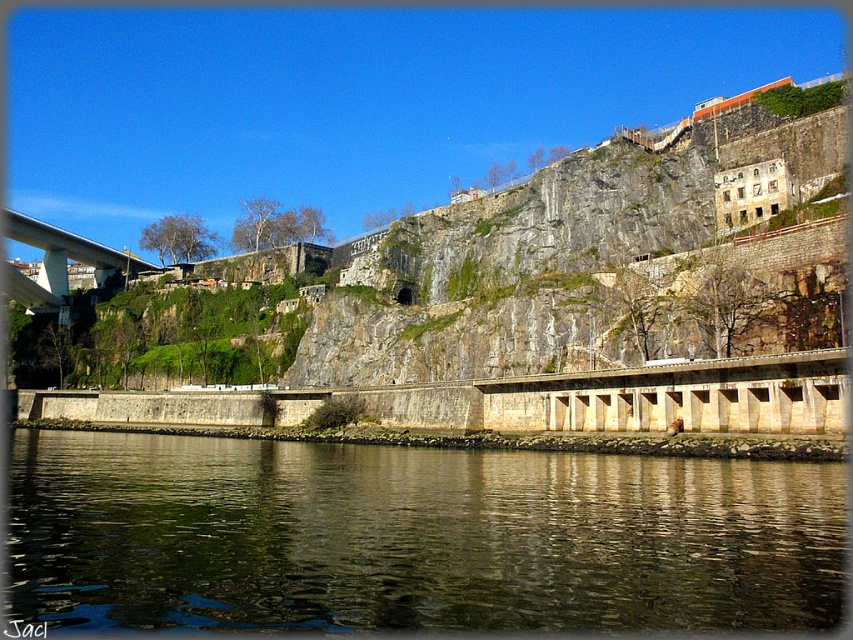
Question: Is dark reflective water at lower center bigger than concrete bridge at left?

Choices:
 (A) yes
 (B) no

Answer: (B)

Question: Is dark reflective water at lower center below concrete bridge at left?

Choices:
 (A) no
 (B) yes

Answer: (B)

Question: Among these objects, which one is nearest to the camera?

Choices:
 (A) dark reflective water at lower center
 (B) concrete bridge at left

Answer: (A)

Question: Which object appears farthest from the camera in this image?

Choices:
 (A) dark reflective water at lower center
 (B) concrete bridge at left

Answer: (B)

Question: Is dark reflective water at lower center to the right of concrete bridge at left from the viewer's perspective?

Choices:
 (A) yes
 (B) no

Answer: (A)

Question: Which point appears farthest from the camera in this image?

Choices:
 (A) (42, 292)
 (B) (810, 611)

Answer: (A)